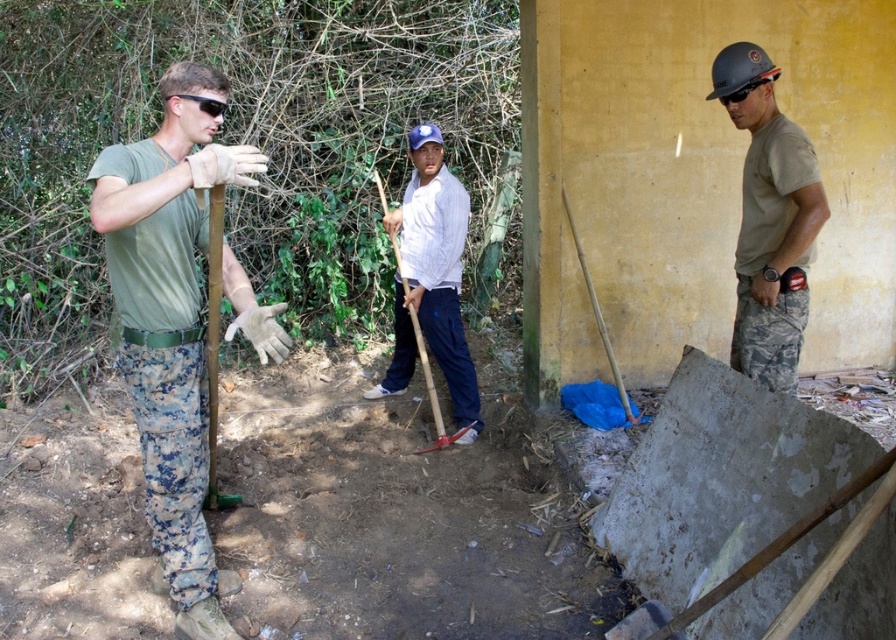
You are a construction worker who needs to reach the wooden shovel at center. You are currently standing next to the camouflage pants at right. Which object is closer to you?

The camouflage pants at right is much taller as wooden shovel at center, so the wooden shovel at center is closer to you.

You are a construction worker who needs to choose between the camouflage pants at right and the wooden shovel at center for a task requiring a thicker material. Which object should you select?

The wooden shovel at center is thicker than the camouflage pants at right, so you should select the wooden shovel at center for the task requiring a thicker material.